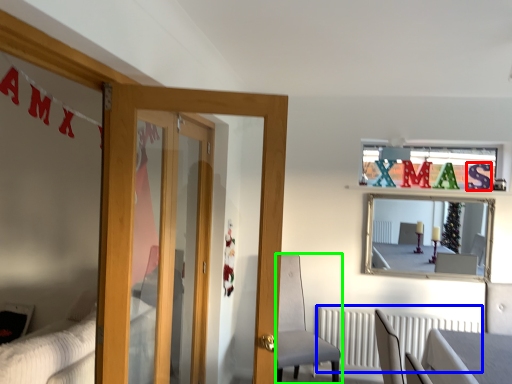
Question: Which object is the closest to the letter (highlighted by a red box)? Choose among these: radiator (highlighted by a blue box) or chair (highlighted by a green box).

Choices:
 (A) radiator
 (B) chair

Answer: (A)